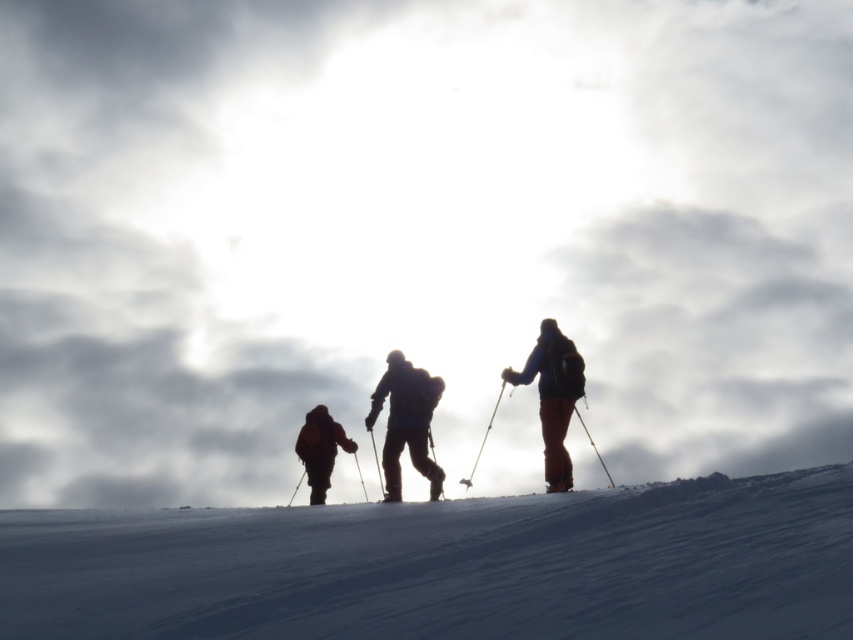
Question: Estimate the real-world distances between objects in this image. Which object is closer to the white snow at center?

Choices:
 (A) dark brown jacket at center
 (B) dark blue fabric backpack at center

Answer: (B)

Question: Which point appears farthest from the camera in this image?

Choices:
 (A) [320, 417]
 (B) [427, 378]
 (C) [540, 365]

Answer: (A)

Question: Is dark blue fabric backpack at center thinner than orange fabric jacket at right?

Choices:
 (A) yes
 (B) no

Answer: (B)

Question: Does white snow at center come behind dark brown jacket at center?

Choices:
 (A) no
 (B) yes

Answer: (A)

Question: Which is farther from the dark brown jacket at center?

Choices:
 (A) orange fabric jacket at right
 (B) dark blue fabric backpack at center
 (C) white snow at center

Answer: (C)

Question: Does orange fabric jacket at right have a smaller size compared to dark brown jacket at center?

Choices:
 (A) yes
 (B) no

Answer: (B)